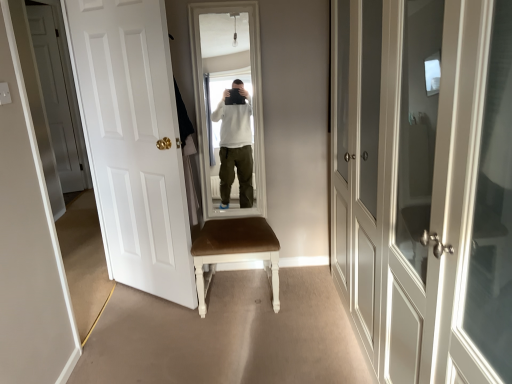
Question: Is white glossy door at left, marked as the second door in a right-to-left arrangement, completely or partially outside of white matte door at left, acting as the first door starting from the back?

Choices:
 (A) yes
 (B) no

Answer: (A)

Question: Considering the relative sizes of white glossy door at left, marked as the second door in a right-to-left arrangement, and white matte door at left, which is the third door in right-to-left order, in the image provided, is white glossy door at left, marked as the second door in a right-to-left arrangement, bigger than white matte door at left, which is the third door in right-to-left order,?

Choices:
 (A) yes
 (B) no

Answer: (A)

Question: Does white glossy door at left, which ranks as the 2th door in front-to-back order, turn towards white matte door at left, the 1th door when ordered from left to right?

Choices:
 (A) yes
 (B) no

Answer: (B)

Question: Is white glossy door at left, marked as the second door in a right-to-left arrangement, positioned with its back to white matte door at left, the 1th door when ordered from left to right?

Choices:
 (A) no
 (B) yes

Answer: (A)

Question: Is white glossy door at left, marked as the second door in a right-to-left arrangement, taller than white matte door at left, the 1th door when ordered from left to right?

Choices:
 (A) no
 (B) yes

Answer: (A)

Question: From a real-world perspective, is white glossy door at left, which ranks as the 2th door in front-to-back order, under white matte door at left, arranged as the third door when viewed from the front?

Choices:
 (A) yes
 (B) no

Answer: (A)

Question: From a real-world perspective, is white matte door at left, which is the third door in right-to-left order, positioned over white glossy cabinet doors at right, which is the third door in back-to-front order, based on gravity?

Choices:
 (A) no
 (B) yes

Answer: (B)

Question: Is white matte door at left, the 1th door when ordered from left to right, outside of white glossy cabinet doors at right, which is the third door in back-to-front order?

Choices:
 (A) yes
 (B) no

Answer: (A)

Question: From a real-world perspective, does white matte door at left, arranged as the third door when viewed from the front, sit lower than white glossy cabinet doors at right, the 3th door positioned from the left?

Choices:
 (A) no
 (B) yes

Answer: (A)

Question: Is white matte door at left, arranged as the third door when viewed from the front, smaller than white glossy cabinet doors at right, the 3th door positioned from the left?

Choices:
 (A) no
 (B) yes

Answer: (B)

Question: Is white matte door at left, which is the third door in right-to-left order, closer to camera compared to white glossy cabinet doors at right, placed as the first door when sorted from right to left?

Choices:
 (A) no
 (B) yes

Answer: (A)

Question: Would you say white glossy cabinet doors at right, which is the third door in back-to-front order, is part of white matte door at left, the 1th door when ordered from left to right,'s contents?

Choices:
 (A) yes
 (B) no

Answer: (B)

Question: Is white glossy door at left, marked as the second door in a right-to-left arrangement, at the right side of white glossy cabinet doors at right, the 3th door positioned from the left?

Choices:
 (A) yes
 (B) no

Answer: (B)